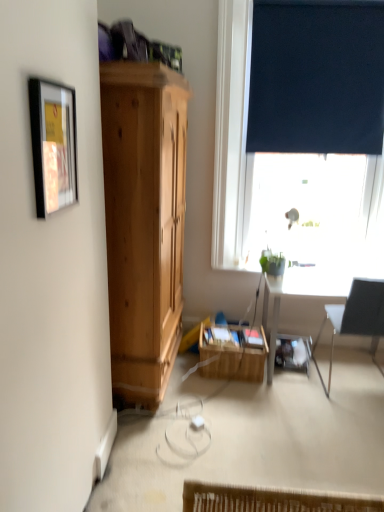
Question: Choose the correct answer: Is green matte plant at window inside dark blue roller blind at upper right or outside it?

Choices:
 (A) inside
 (B) outside

Answer: (B)

Question: Is green matte plant at window bigger or smaller than dark blue roller blind at upper right?

Choices:
 (A) big
 (B) small

Answer: (B)

Question: Estimate the real-world distances between objects in this image. Which object is farther from the dark blue fabric at upper right?

Choices:
 (A) green matte plant at window
 (B) woven wood basket at center
 (C) matte black picture frame at upper left
 (D) dark blue roller blind at upper right
 (E) black fabric chair at right

Answer: (C)

Question: Based on their relative distances, which object is nearer to the black fabric chair at right?

Choices:
 (A) green matte plant at window
 (B) matte black picture frame at upper left
 (C) woven wood basket at center
 (D) dark blue roller blind at upper right
 (E) dark blue fabric at upper right

Answer: (A)